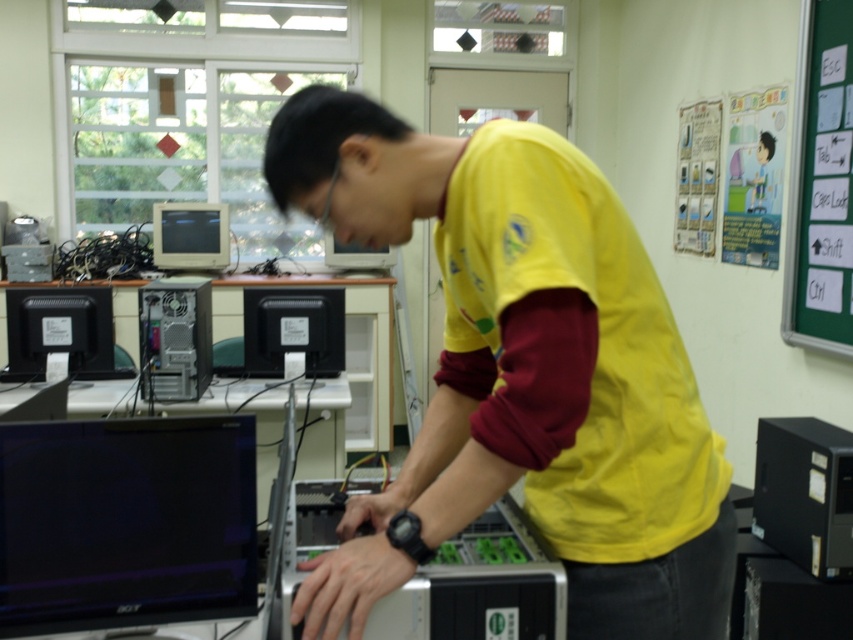
In the scene shown: Who is positioned more to the left, black plastic monitor at center or matte black monitor at left?

From the viewer's perspective, matte black monitor at left appears more on the left side.

Which of these two, black plastic monitor at center or matte black monitor at left, stands shorter?

black plastic monitor at center is shorter.

Who is more forward, (x=322, y=307) or (x=199, y=234)?

Point (x=322, y=307) is in front.

Where is `black plastic monitor at center`? black plastic monitor at center is located at coordinates (293, 330).

Is black plastic monitor at center to the left of matte black monitor at center from the viewer's perspective?

Correct, you'll find black plastic monitor at center to the left of matte black monitor at center.

Can you confirm if black plastic monitor at center is taller than matte black monitor at center?

Yes.

At what (x,y) coordinates should I click in order to perform the action: click on black plastic monitor at center. Please return your answer as a coordinate pair (x, y). Looking at the image, I should click on (293, 330).

Who is positioned more to the left, yellow fabric shirt at center or satin black case at center?

Result: satin black case at center is more to the left.

Is point (524, 170) positioned after point (180, 291)?

No, (524, 170) is closer to viewer.

The height and width of the screenshot is (640, 853). I want to click on yellow fabric shirt at center, so click(x=521, y=372).